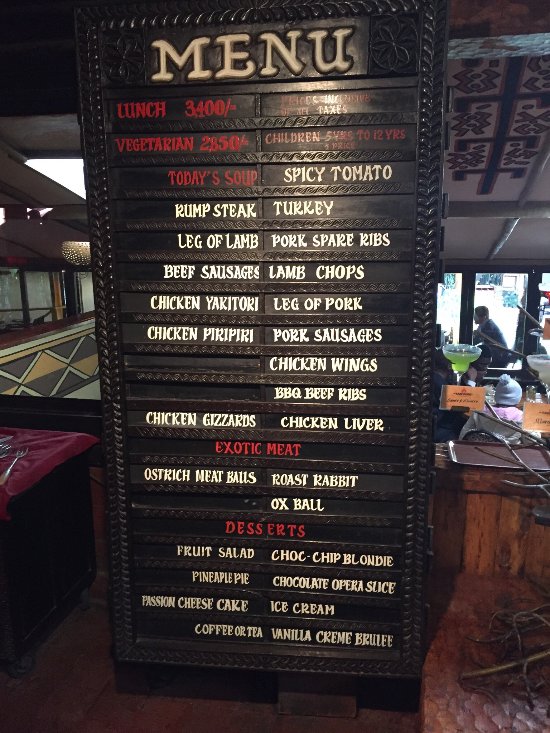
Identify the location of floor. (447, 696).